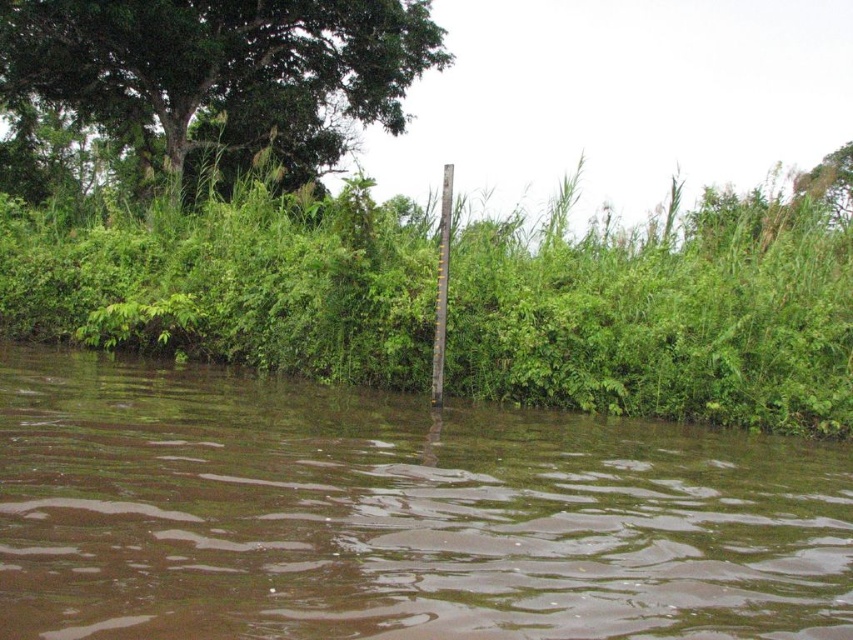
You are standing on the riverside and looking at the image. You notice a point marked at coordinates (395, 515). What does this point indicate?

The point at coordinates (395, 515) indicates brown muddy water at center.

Based on the scene, can you determine the position of the green leafy vegetation at center relative to the green leafy tree at upper left?

The green leafy vegetation at center is to the right of the green leafy tree at upper left.

You are standing on the riverside path and want to take a photo of the green leafy tree at upper left and the brown muddy water at center. Which object should you adjust your camera to focus on first if you want both in the frame?

The green leafy tree at upper left should be focused on first because it is closer to the camera than the brown muddy water at center, which is further away.